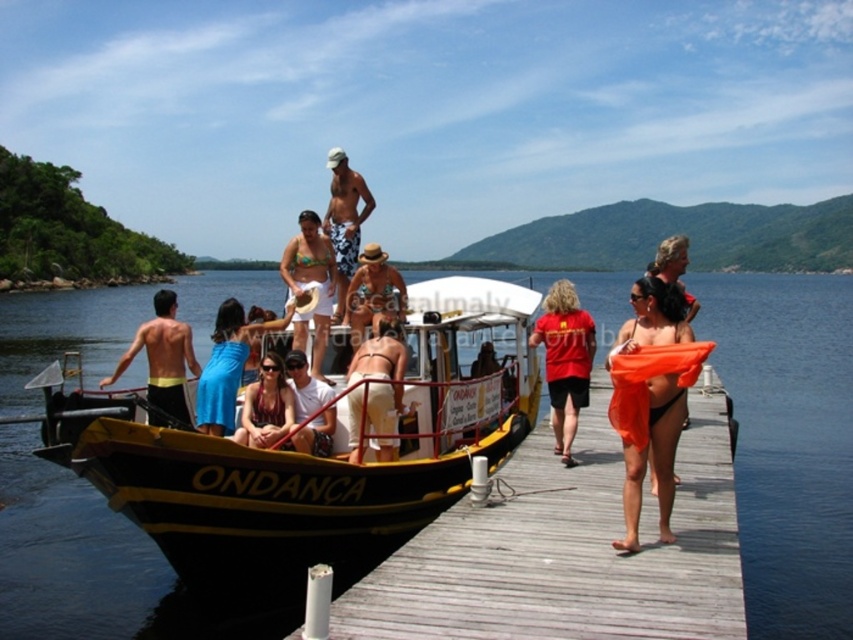
Question: Is black matte shorts at left in front of beige fabric hat at center?

Choices:
 (A) yes
 (B) no

Answer: (A)

Question: Does beige fabric hat at center have a smaller size compared to white textured shorts at center?

Choices:
 (A) yes
 (B) no

Answer: (A)

Question: Which object is closer to the camera taking this photo?

Choices:
 (A) white cotton shirt at center
 (B) orange fabric at center
 (C) tan straw hat at center

Answer: (B)

Question: Which of the following is the farthest from the observer?

Choices:
 (A) tan skin bikini at center
 (B) matte black bikini at center
 (C) black wood boat at center
 (D) white cotton shirt at center

Answer: (D)

Question: Estimate the real-world distances between objects in this image. Which object is farther from the black wood boat at center?

Choices:
 (A) beige fabric hat at center
 (B) tan skin bikini at center
 (C) matte black bikini at center

Answer: (A)

Question: Can you confirm if black wood boat at center is positioned below matte orange towel at center?

Choices:
 (A) no
 (B) yes

Answer: (B)